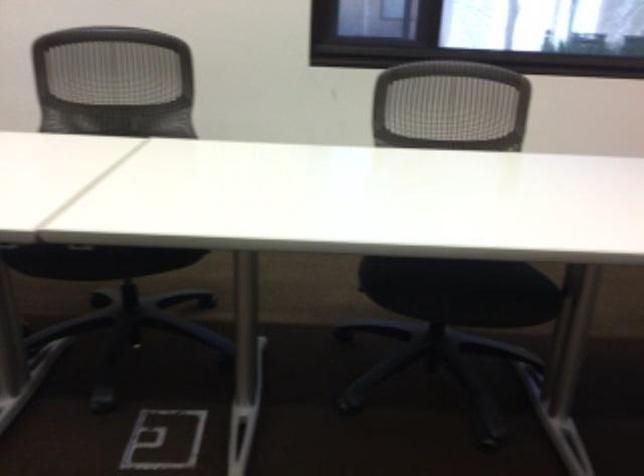
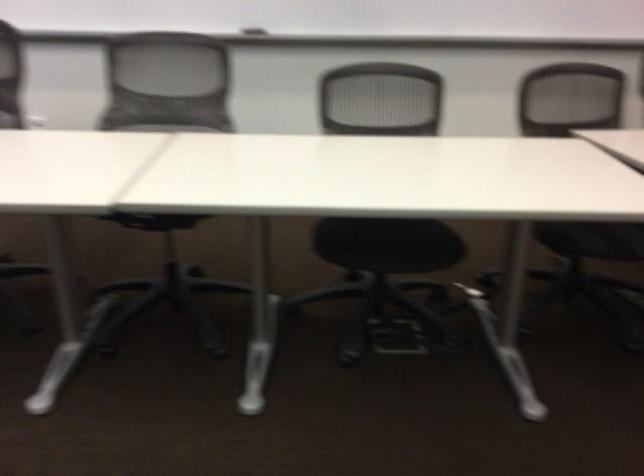
Based on the continuous images, in which direction is the camera rotating?

The camera's rotation is toward right-down.